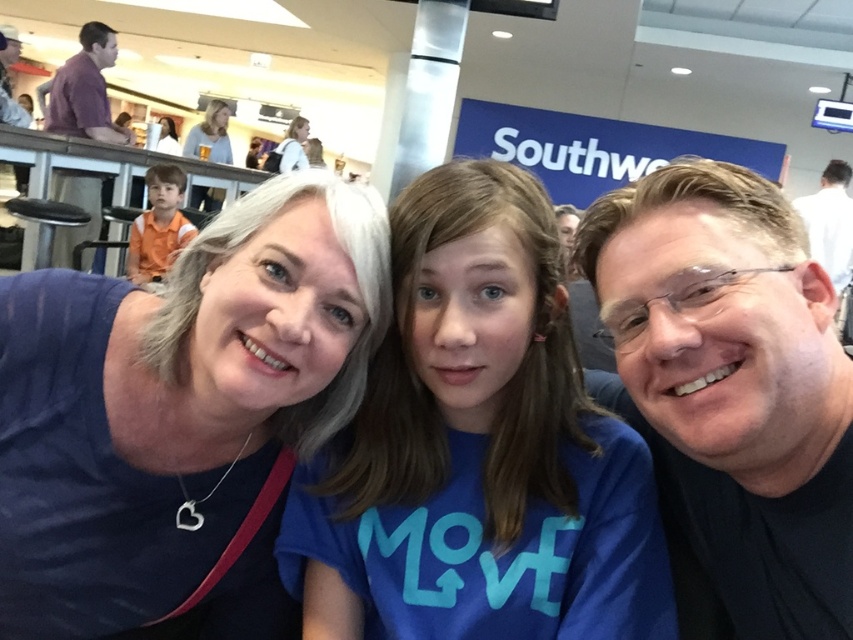
Based on the photo, in the group selfie taken at the airport, there is a point marked at coordinates (210, 134). What object is located at this specific point?

The point at (210, 134) is occupied by matte white hair at upper center.

You are trying to decide whether to place a new item in your bag on top of the matte black backpack at upper center or next to the blue cotton shirt at center. Based on their sizes, which location would you choose?

The blue cotton shirt at center has a smaller size compared to matte black backpack at upper center. Therefore, placing the new item next to the blue cotton shirt at center might be more feasible since there is more space available on the larger matte black backpack at upper center.